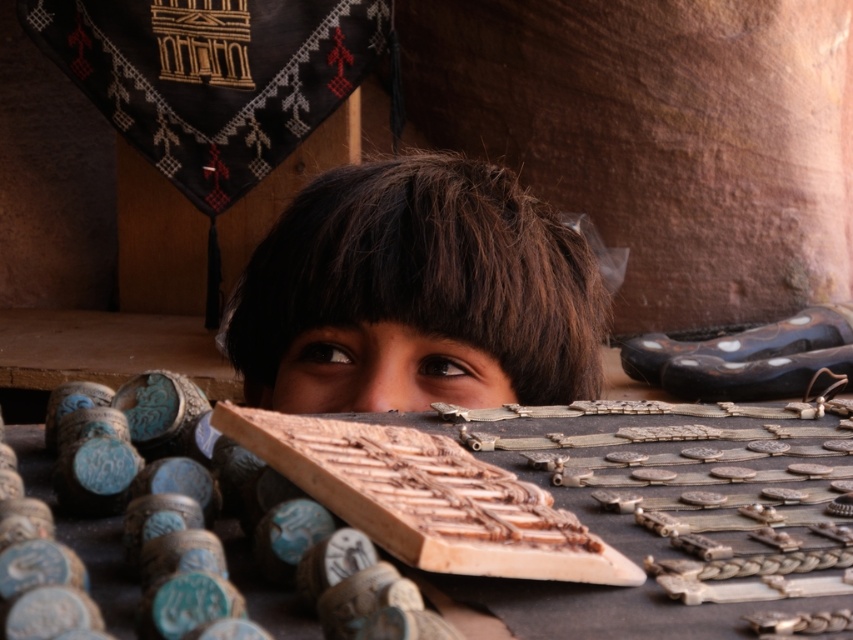
Measure the distance between brown matte face at center and camera.

63.33 centimeters

Does brown matte face at center have a smaller size compared to brown matte eye at upper center?

No.

Does point (407, 358) come in front of point (466, 369)?

Yes, point (407, 358) is closer to viewer.

Identify the location of brown matte face at center. click(380, 371).

Is brown matte face at center bigger than brown matte eye at center?

Yes.

Does brown matte face at center have a greater width compared to brown matte eye at center?

Yes.

Who is more forward, (440, 355) or (339, 368)?

Point (440, 355) is more forward.

This screenshot has width=853, height=640. What are the coordinates of `brown matte face at center` in the screenshot? It's located at (380, 371).

Which is more to the left, brown matte hair at center or brown matte eye at upper center?

brown matte eye at upper center

Is brown matte hair at center below brown matte eye at upper center?

No, brown matte hair at center is not below brown matte eye at upper center.

Is point (328, 257) less distant than point (456, 376)?

Yes, it is in front of point (456, 376).

At what (x,y) coordinates should I click in order to perform the action: click on brown matte hair at center. Please return your answer as a coordinate pair (x, y). Looking at the image, I should click on [x=418, y=291].